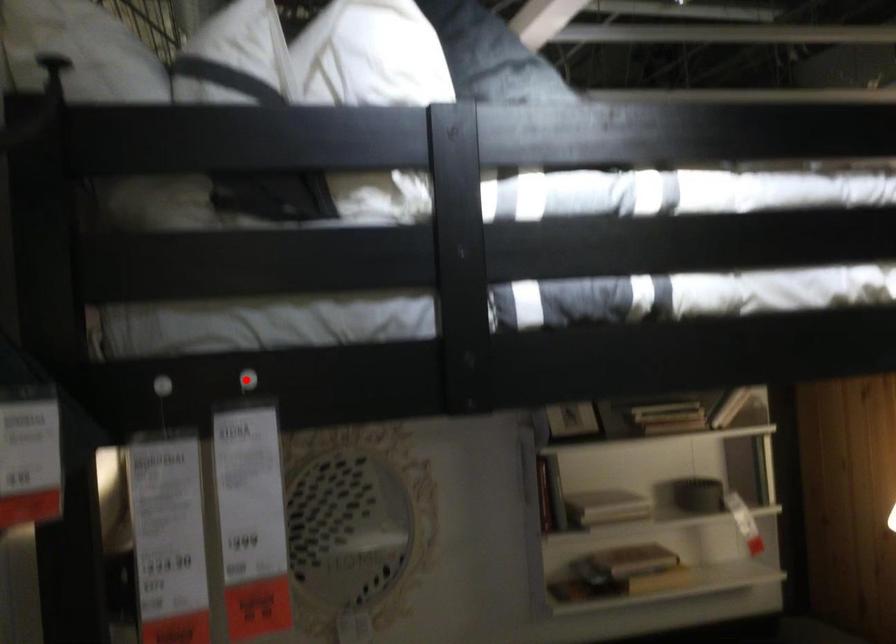
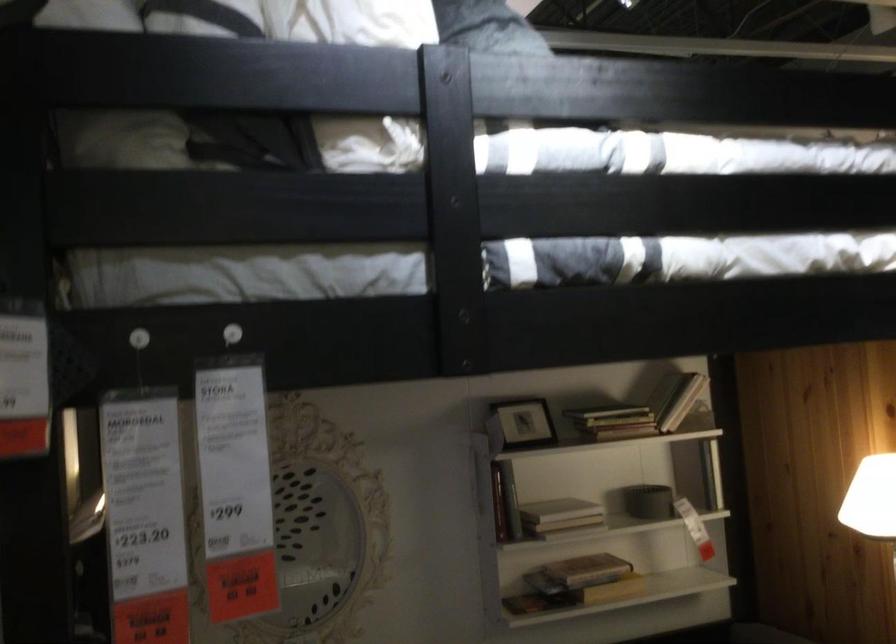
Locate, in the second image, the point that corresponds to the highlighted location in the first image.

(231, 333)